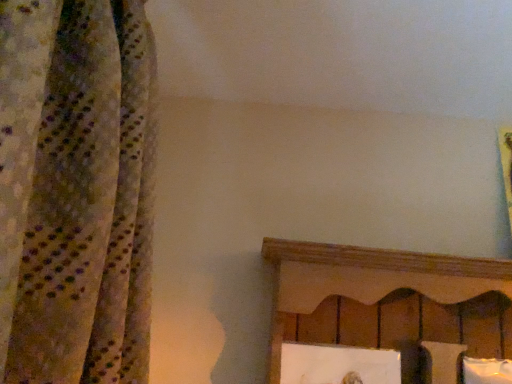
Question: Is white matte picture frame at lower center wider or thinner than white soft pillow at lower right?

Choices:
 (A) wide
 (B) thin

Answer: (B)

Question: Is white matte picture frame at lower center situated inside white soft pillow at lower right or outside?

Choices:
 (A) outside
 (B) inside

Answer: (A)

Question: From the image's perspective, is white matte picture frame at lower center above or below white soft pillow at lower right?

Choices:
 (A) below
 (B) above

Answer: (B)

Question: Considering the relative positions of white soft pillow at lower right and white matte picture frame at lower center in the image provided, is white soft pillow at lower right to the left or to the right of white matte picture frame at lower center?

Choices:
 (A) left
 (B) right

Answer: (B)

Question: From a real-world perspective, relative to white matte picture frame at lower center, is white soft pillow at lower right vertically above or below?

Choices:
 (A) below
 (B) above

Answer: (A)

Question: Considering the positions of point (480, 375) and point (386, 370), is point (480, 375) closer or farther from the camera than point (386, 370)?

Choices:
 (A) farther
 (B) closer

Answer: (B)

Question: In terms of height, does white soft pillow at lower right look taller or shorter compared to white matte picture frame at lower center?

Choices:
 (A) short
 (B) tall

Answer: (B)